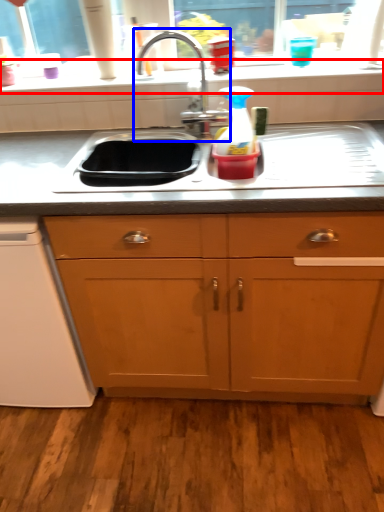
Question: Which point is further to the camera, window sill (highlighted by a red box) or tap (highlighted by a blue box)?

Choices:
 (A) window sill
 (B) tap

Answer: (A)